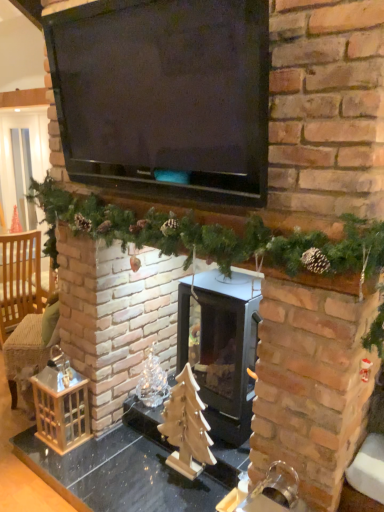
At what (x,y) coordinates should I click in order to perform the action: click on free space above wooden table at center (from a real-world perspective). Please return your answer as a coordinate pair (x, y). The image size is (384, 512). Looking at the image, I should click on (106, 468).